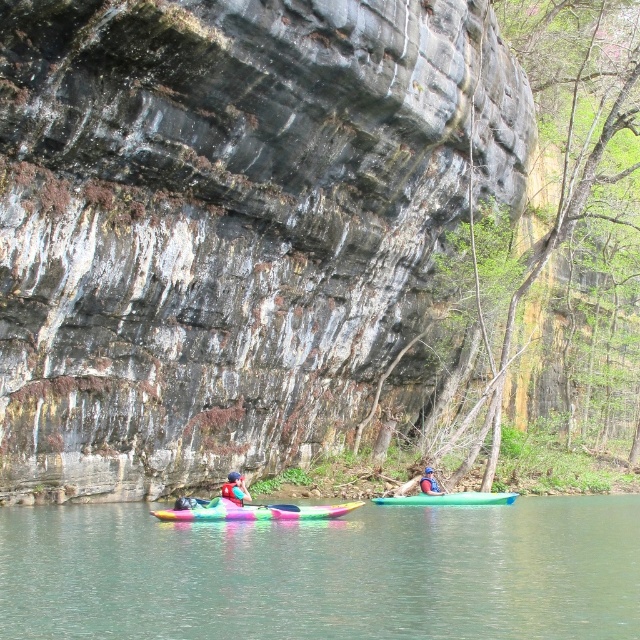
Question: Which object is the farthest from the green rubber kayak at center?

Choices:
 (A) rubber paddle at center
 (B) green plastic canoe at center
 (C) dark gray stone cliff at center

Answer: (B)

Question: Is dark gray stone cliff at center to the right of rubber paddle at center from the viewer's perspective?

Choices:
 (A) yes
 (B) no

Answer: (A)

Question: Which point is farther from the camera taking this photo?

Choices:
 (A) (518, 515)
 (B) (282, 509)

Answer: (A)

Question: Does green rubber kayak at center have a greater width compared to rubber paddle at center?

Choices:
 (A) no
 (B) yes

Answer: (B)

Question: Is green rubber kayak at center above green plastic canoe at center?

Choices:
 (A) yes
 (B) no

Answer: (A)

Question: Considering the real-world distances, which object is closest to the rubber paddle at center?

Choices:
 (A) matte pink kayak at center
 (B) rainbow plastic kayak at center
 (C) green plastic canoe at center

Answer: (B)